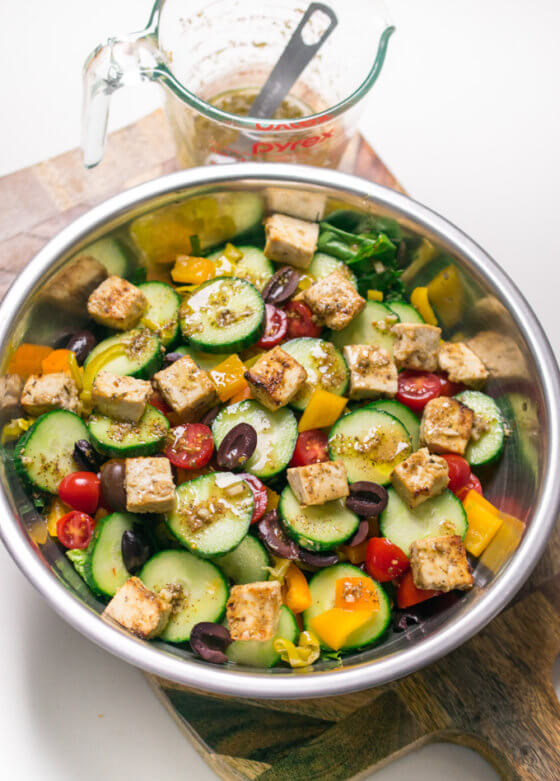
The image size is (560, 781). I want to click on stainless steal bowl, so click(x=326, y=176).